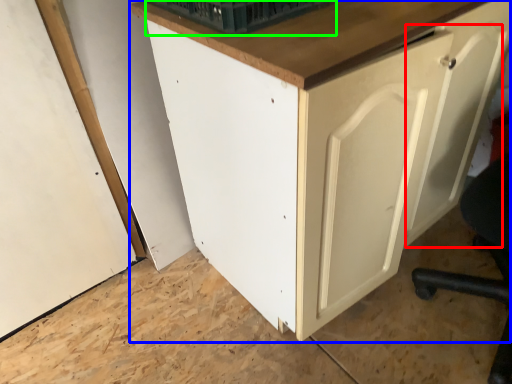
Question: Estimate the real-world distances between objects in this image. Which object is closer to door (highlighted by a red box), cabinetry (highlighted by a blue box) or basket (highlighted by a green box)?

Choices:
 (A) cabinetry
 (B) basket

Answer: (A)